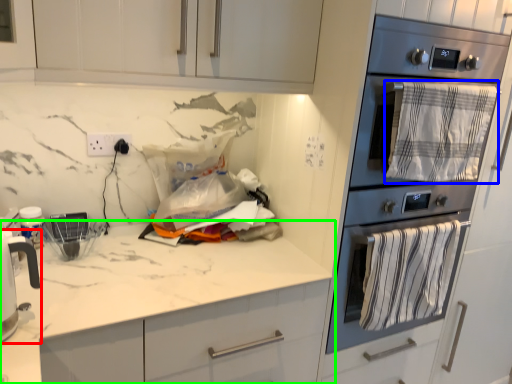
Question: Based on their relative distances, which object is nearer to home appliance (highlighted by a red box)? Choose from blanket (highlighted by a blue box) and countertop (highlighted by a green box).

Choices:
 (A) blanket
 (B) countertop

Answer: (B)